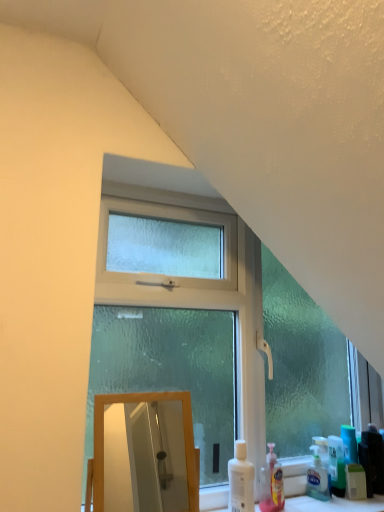
Question: Is wooden mirror at lower left positioned with its back to white plastic bottle at lower right, the 2th cleaning product when ordered from right to left?

Choices:
 (A) no
 (B) yes

Answer: (A)

Question: Does wooden mirror at lower left have a lesser height compared to white plastic bottle at lower right, arranged as the first cleaning product when viewed from the left?

Choices:
 (A) no
 (B) yes

Answer: (A)

Question: From the image's perspective, is wooden mirror at lower left located beneath white plastic bottle at lower right, arranged as the first cleaning product when viewed from the left?

Choices:
 (A) no
 (B) yes

Answer: (A)

Question: From a real-world perspective, is wooden mirror at lower left positioned over white plastic bottle at lower right, arranged as the first cleaning product when viewed from the left, based on gravity?

Choices:
 (A) yes
 (B) no

Answer: (A)

Question: From the image's perspective, is wooden mirror at lower left over white plastic bottle at lower right, the 2th cleaning product when ordered from right to left?

Choices:
 (A) no
 (B) yes

Answer: (B)

Question: Is the depth of wooden mirror at lower left greater than that of white plastic bottle at lower right, arranged as the first cleaning product when viewed from the left?

Choices:
 (A) yes
 (B) no

Answer: (B)

Question: Is white plastic bottle at lower right, the 2th cleaning product when ordered from right to left, a part of frosted glass window at center?

Choices:
 (A) yes
 (B) no

Answer: (B)

Question: Considering the relative positions of frosted glass window at center and white plastic bottle at lower right, the 2th cleaning product when ordered from right to left, in the image provided, is frosted glass window at center behind white plastic bottle at lower right, the 2th cleaning product when ordered from right to left,?

Choices:
 (A) no
 (B) yes

Answer: (A)

Question: From a real-world perspective, is frosted glass window at center physically above white plastic bottle at lower right, arranged as the first cleaning product when viewed from the left?

Choices:
 (A) no
 (B) yes

Answer: (B)

Question: Is frosted glass window at center not close to white plastic bottle at lower right, arranged as the first cleaning product when viewed from the left?

Choices:
 (A) no
 (B) yes

Answer: (A)

Question: Are frosted glass window at center and white plastic bottle at lower right, the 2th cleaning product when ordered from right to left, beside each other?

Choices:
 (A) yes
 (B) no

Answer: (B)

Question: Is frosted glass window at center to the left of white plastic bottle at lower right, the 2th cleaning product when ordered from right to left, from the viewer's perspective?

Choices:
 (A) yes
 (B) no

Answer: (B)

Question: From a real-world perspective, is wooden mirror at lower left located beneath frosted glass window at center?

Choices:
 (A) yes
 (B) no

Answer: (A)